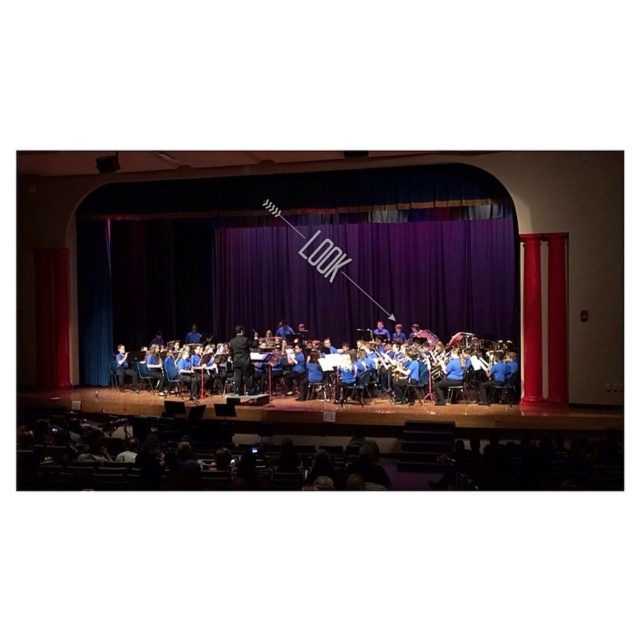
Question: Is purple velvet curtain at center smaller than blue fabric band at center?

Choices:
 (A) no
 (B) yes

Answer: (A)

Question: Which object is farther from the camera taking this photo?

Choices:
 (A) blue fabric band at center
 (B) purple velvet curtain at center
 (C) blue fabric curtain at center

Answer: (B)

Question: Can you confirm if purple velvet curtain at center is thinner than blue fabric band at center?

Choices:
 (A) yes
 (B) no

Answer: (B)

Question: Which object is farther from the camera taking this photo?

Choices:
 (A) blue fabric curtain at center
 (B) purple velvet curtain at center

Answer: (B)

Question: Which of the following is the farthest from the observer?

Choices:
 (A) blue fabric band at center
 (B) blue metallic flute at center
 (C) blue fabric curtain at center

Answer: (A)

Question: Can you confirm if purple velvet curtain at center is smaller than blue metallic flute at center?

Choices:
 (A) yes
 (B) no

Answer: (B)